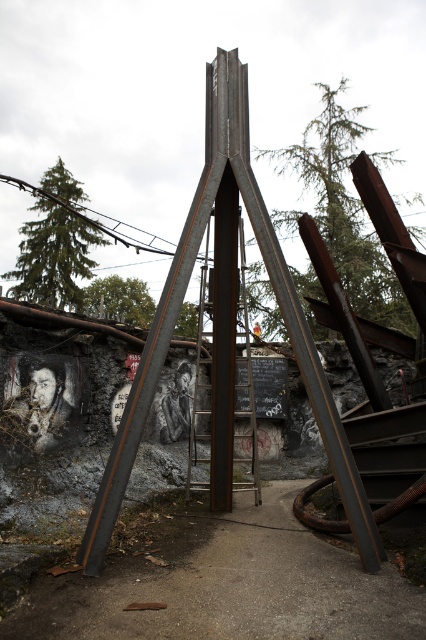
Question: Is concrete at center to the left of rusty metal ladder at center from the viewer's perspective?

Choices:
 (A) yes
 (B) no

Answer: (B)

Question: Which object is farther from the camera taking this photo?

Choices:
 (A) concrete at center
 (B) rusty metal ladder at center

Answer: (B)

Question: Among these objects, which one is farthest from the camera?

Choices:
 (A) rusty metal ladder at center
 (B) concrete at center

Answer: (A)

Question: Does concrete at center have a greater width compared to rusty metal ladder at center?

Choices:
 (A) no
 (B) yes

Answer: (B)

Question: Can you confirm if concrete at center is wider than rusty metal ladder at center?

Choices:
 (A) yes
 (B) no

Answer: (A)